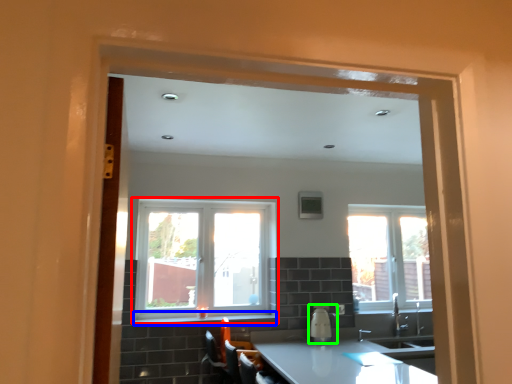
Question: Estimate the real-world distances between objects in this image. Which object is closer to window (highlighted by a red box), window sill (highlighted by a blue box) or appliance (highlighted by a green box)?

Choices:
 (A) window sill
 (B) appliance

Answer: (A)